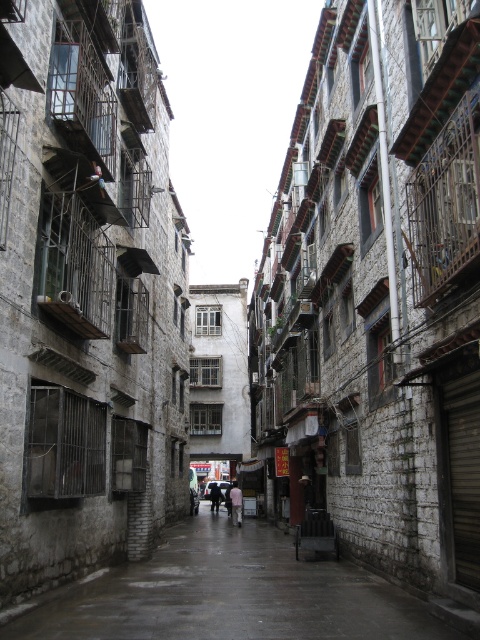
You are a delivery person carrying a heavy box and need to walk through the alley. The box is 1.2 meters tall. Is there enough vertical clearance between the smooth stone pavement at center and the buildings above to safely pass through?

The distance between the smooth stone pavement at center and the viewer is 10.81 meters. Since the box is only 1.2 meters tall, there is ample vertical clearance to safely pass through the alley.

From the picture: You are a delivery person trying to navigate through the narrow alleyway. You see the smooth stone pavement at center and the pink fabric person at center. Which path should you choose to ensure you have enough space for your delivery cart?

The smooth stone pavement at center has a larger width than the pink fabric person at center, so you should choose the path along the smooth stone pavement at center to ensure enough space for your delivery cart.

You are a delivery person trying to navigate through the alley. You see the smooth stone pavement at center and the transparent plastic umbrella at center. Which object is positioned to the right of the other?

The smooth stone pavement at center is to the right of the transparent plastic umbrella at center.